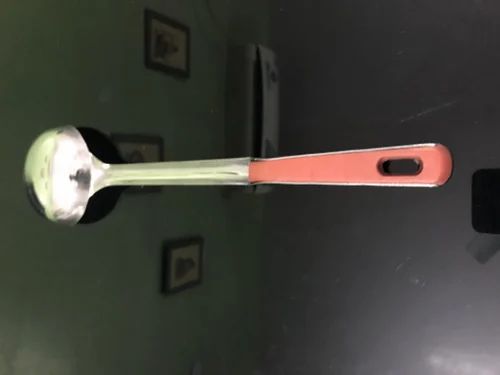
The image size is (500, 375). What are the coordinates of `leftmost frame` in the screenshot? It's located at (x=144, y=138).